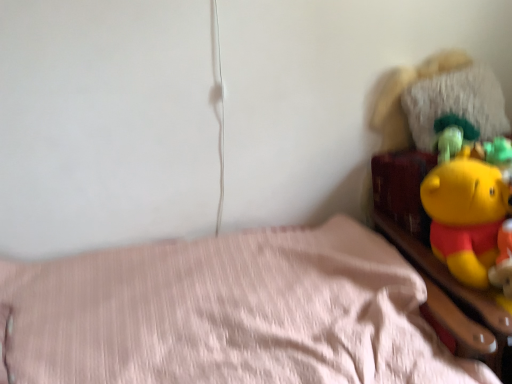
Question: In terms of height, does fuzzy white pillow at upper right look taller or shorter compared to pink fabric bed at lower left?

Choices:
 (A) tall
 (B) short

Answer: (B)

Question: Does point (445, 105) appear closer or farther from the camera than point (94, 307)?

Choices:
 (A) farther
 (B) closer

Answer: (A)

Question: Based on their relative distances, which object is farther from the yellow plush toy at upper right?

Choices:
 (A) fuzzy white pillow at upper right
 (B) pink fabric bed at lower left

Answer: (B)

Question: Which object is the closest to the pink fabric bed at lower left?

Choices:
 (A) fuzzy white pillow at upper right
 (B) yellow plush toy at upper right

Answer: (B)